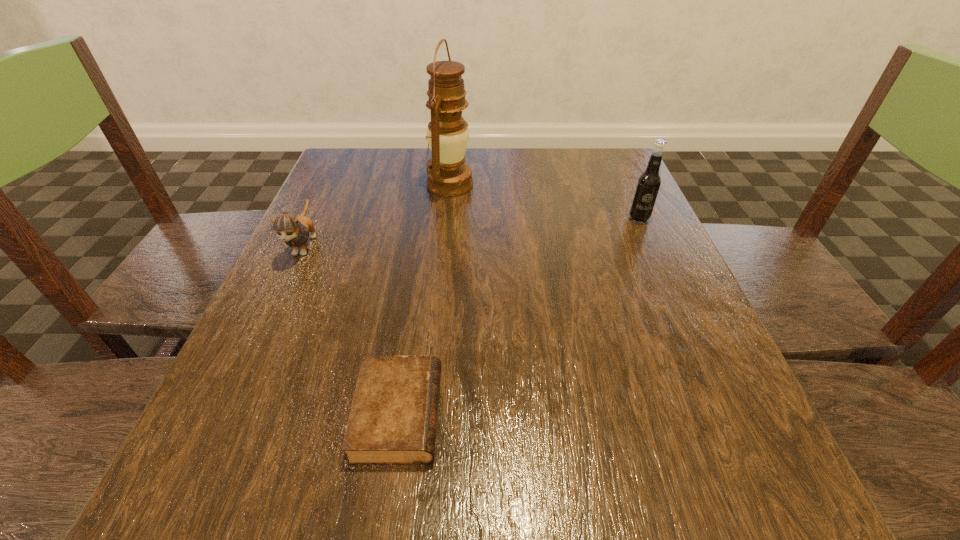
Locate an element on the screen. vacant area that lies between the diary and the third shortest object is located at coordinates (518, 316).

This screenshot has height=540, width=960. In order to click on empty location between the tallest object and the kitten in this screenshot , I will do `click(377, 214)`.

Select which object appears as the third closest to the oil lamp. Please provide its 2D coordinates. Your answer should be formatted as a tuple, i.e. [(x, y)], where the tuple contains the x and y coordinates of a point satisfying the conditions above.

[(393, 419)]

Where is `the closest object to the rightmost object`? The image size is (960, 540). the closest object to the rightmost object is located at coordinates pos(448,175).

Identify the location of vacant space that satisfies the following two spatial constraints: 1. on the label of the rightmost object; 2. on the spine side of the nearest object. This screenshot has height=540, width=960. (727, 414).

The width and height of the screenshot is (960, 540). In order to click on vacant position in the image that satisfies the following two spatial constraints: 1. on the label of the second tallest object; 2. on the spine side of the nearest object in this screenshot , I will do `click(727, 414)`.